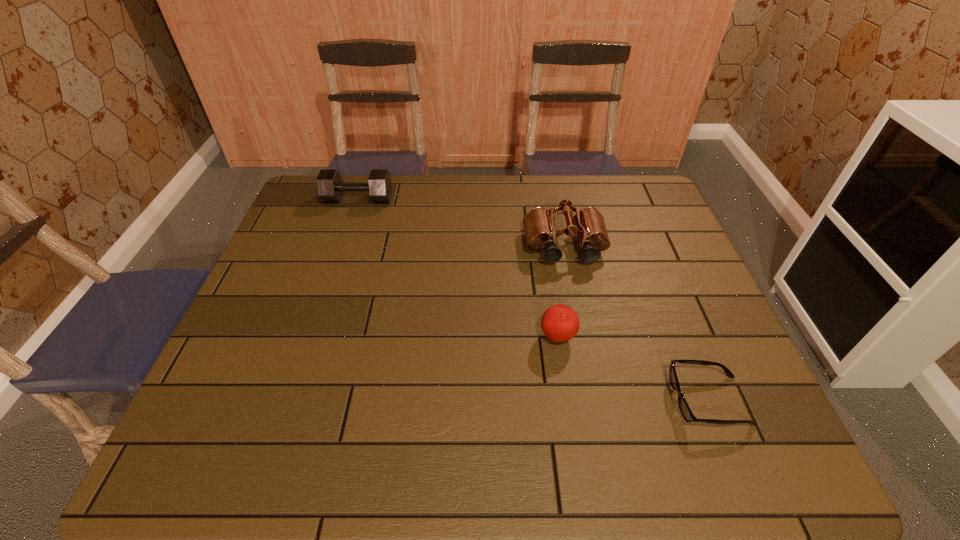
Where is `vacant area at the near edge of the desktop`? This screenshot has width=960, height=540. vacant area at the near edge of the desktop is located at coordinates (416, 443).

Locate an element on the screen. free space at the left edge is located at coordinates (276, 343).

Locate an element on the screen. This screenshot has width=960, height=540. vacant space at the right edge of the desktop is located at coordinates (711, 357).

In the image, there is a desktop. In order to click on free space at the far right corner in this screenshot , I will do `click(642, 199)`.

The height and width of the screenshot is (540, 960). I want to click on free spot between the binoculars and the apple, so click(561, 292).

Locate an element on the screen. The height and width of the screenshot is (540, 960). free space between the farthest object and the second farthest object is located at coordinates (462, 224).

Locate an element on the screen. blank region between the binoculars and the farthest object is located at coordinates (462, 224).

At what (x,y) coordinates should I click in order to perform the action: click on free point between the spectacles and the second nearest object. Please return your answer as a coordinate pair (x, y). Looking at the image, I should click on (633, 369).

At what (x,y) coordinates should I click in order to perform the action: click on unoccupied position between the nearest object and the binoculars. Please return your answer as a coordinate pair (x, y). Looking at the image, I should click on (636, 324).

The width and height of the screenshot is (960, 540). In order to click on empty space between the dumbbell and the shortest object in this screenshot , I will do `click(533, 300)`.